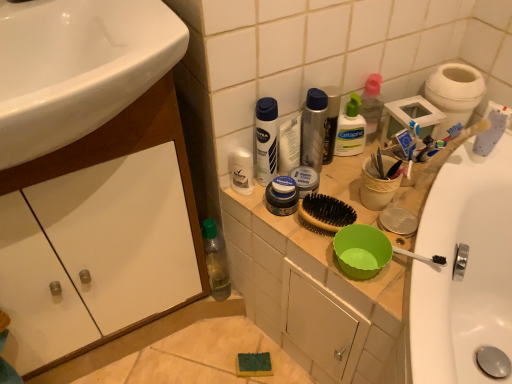
Question: From the image's perspective, is clear plastic bottle at upper center, which is the first toiletry from right to left, above or below green plastic bottle at lower left?

Choices:
 (A) above
 (B) below

Answer: (A)

Question: In terms of width, does clear plastic bottle at upper center, which is the first toiletry from right to left, look wider or thinner when compared to green plastic bottle at lower left?

Choices:
 (A) wide
 (B) thin

Answer: (B)

Question: Which of these objects is positioned closest to the metallic silver deodorant at upper center, acting as the 2th toiletry starting from the right?

Choices:
 (A) translucent plastic mouthwash at center, the first mouthwash positioned from the right
 (B) green plastic bottle at lower left
 (C) matte plastic toiletries at upper right
 (D) white glossy sink at left
 (E) white glossy cabinet at lower left

Answer: (A)

Question: Which of these objects is positioned closest to the white glossy cabinet at lower left?

Choices:
 (A) white glossy deodorant at center, the 4th toiletry from the right
 (B) white glossy sink at left
 (C) matte silver container at center, which is the third toiletry in right-to-left order
 (D) metallic silver deodorant at upper center, acting as the 2th toiletry starting from the right
 (E) translucent plastic mouthwash at center, the first mouthwash positioned from the right

Answer: (B)